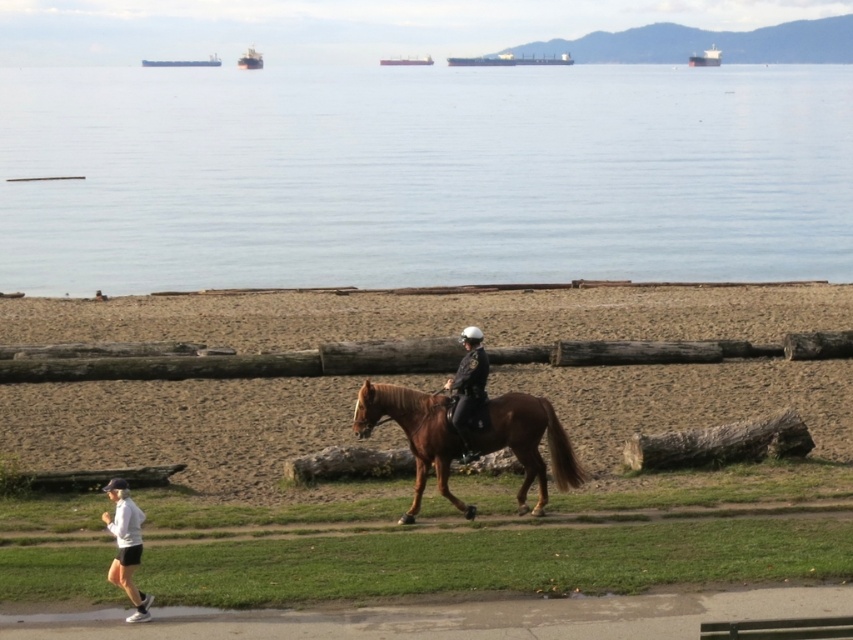
You are a swimmer who wants to cross the clear water at upper center. You have a white matte jacket at lower left that is 1 meter wide. Can you use the jacket to cross the water if the jacket can only support your weight if it is wider than the water?

The clear water at upper center might be wider than the white matte jacket at lower left. Since the jacket is only 1 meter wide, it may not be wide enough to support your weight if the water is wider. Therefore, it is not advisable to use the jacket for crossing.

You are standing at the edge of the beach looking towards the water. You see the clear water at upper center and the shiny black helmet at center. Which object is closer to the left side of your view?

The clear water at upper center is closer to the left side of your view because it is positioned to the left of the shiny black helmet at center.